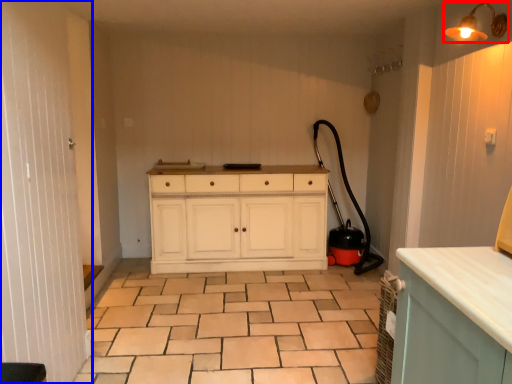
Question: Which point is closer to the camera, light fixture (highlighted by a red box) or screen door (highlighted by a blue box)?

Choices:
 (A) light fixture
 (B) screen door

Answer: (B)